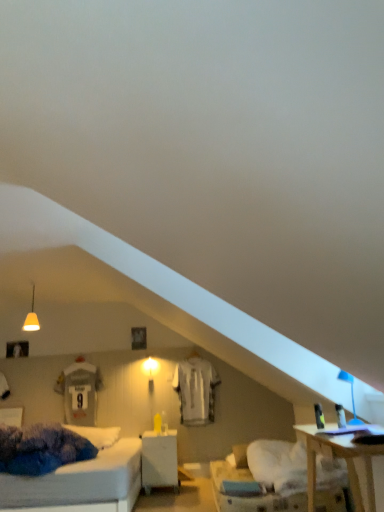
Question: In terms of size, does white jersey at center appear bigger or smaller than blue plastic table lamp at upper right?

Choices:
 (A) big
 (B) small

Answer: (A)

Question: From a real-world perspective, is white jersey at center physically located above or below blue plastic table lamp at upper right?

Choices:
 (A) above
 (B) below

Answer: (A)

Question: Which of these objects is positioned farthest from the white glossy nightstand at center?

Choices:
 (A) matte white pendant light at upper left
 (B) white jersey at center
 (C) white fabric pillow at lower center
 (D) blue plastic table lamp at upper right

Answer: (D)

Question: Considering the real-world distances, which object is farthest from the white jersey at center?

Choices:
 (A) white fabric pillow at lower center
 (B) matte white pendant light at upper left
 (C) blue plastic table lamp at upper right
 (D) white glossy nightstand at center

Answer: (C)